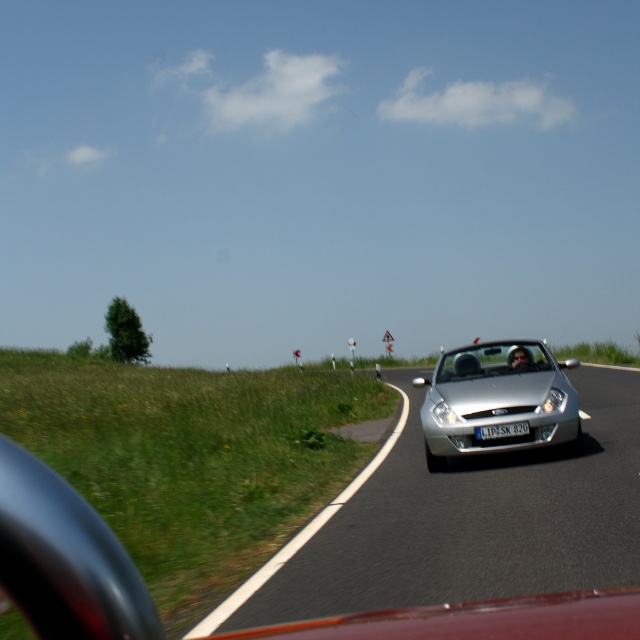
Who is more distant from viewer, (536,500) or (465,412)?

Point (465,412)

Does silver metallic car at center have a greater width compared to silver metallic convertible at center?

Incorrect, silver metallic car at center's width does not surpass silver metallic convertible at center's.

The image size is (640, 640). Identify the location of silver metallic car at center. (461, 522).